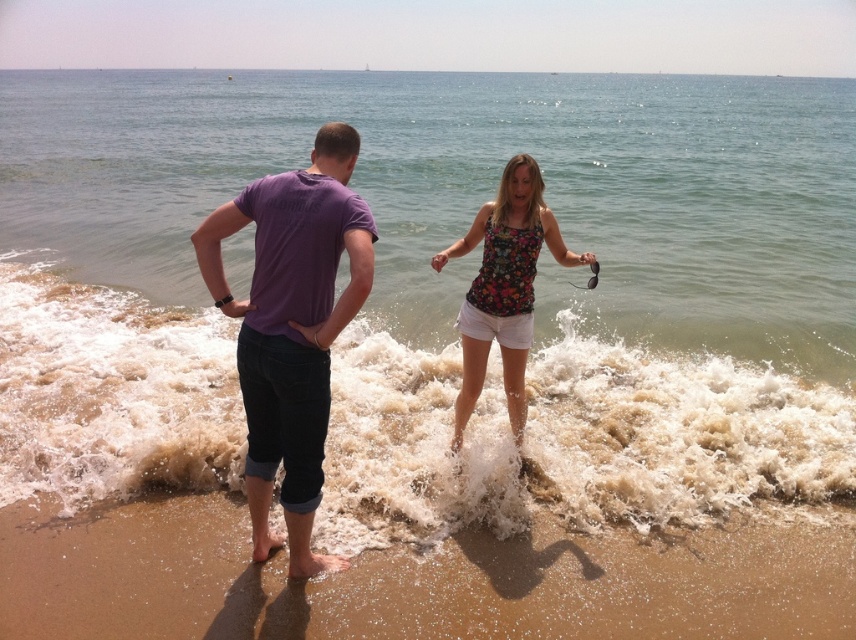
Question: In this image, where is purple cotton shirt at center located relative to floral fabric tank top at center?

Choices:
 (A) above
 (B) below

Answer: (B)

Question: Does purple cotton shirt at center lie in front of purple cotton t-shirt at center?

Choices:
 (A) no
 (B) yes

Answer: (B)

Question: Among these points, which one is farthest from the camera?

Choices:
 (A) (569, 294)
 (B) (289, 348)
 (C) (321, 394)
 (D) (473, 355)

Answer: (A)

Question: Which of these objects is positioned closest to the foamy white wave at lower center?

Choices:
 (A) brown sand at lower left
 (B) floral fabric tank top at center
 (C) clear water at lower center
 (D) purple cotton shirt at center

Answer: (D)

Question: Does clear water at lower center appear on the left side of purple cotton t-shirt at center?

Choices:
 (A) no
 (B) yes

Answer: (A)

Question: Which point is closer to the camera?

Choices:
 (A) brown sand at lower left
 (B) purple cotton shirt at center
 (C) foamy white wave at lower center

Answer: (B)